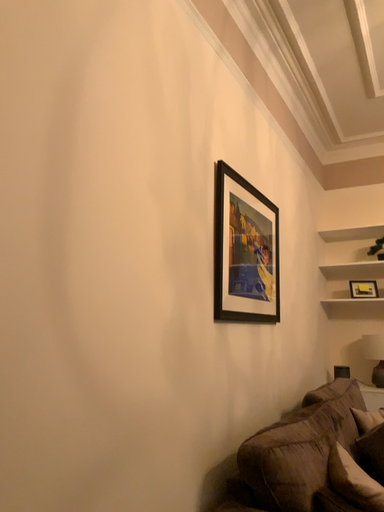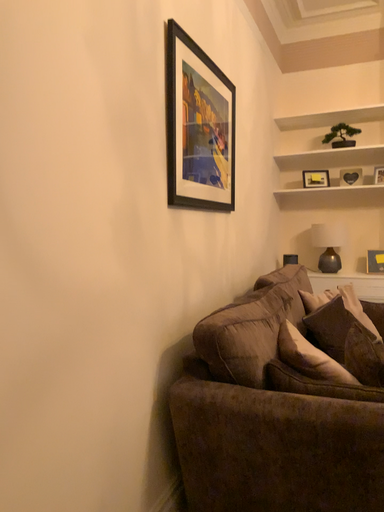
Question: How did the camera likely rotate when shooting the video?

Choices:
 (A) rotated upward
 (B) rotated downward

Answer: (B)